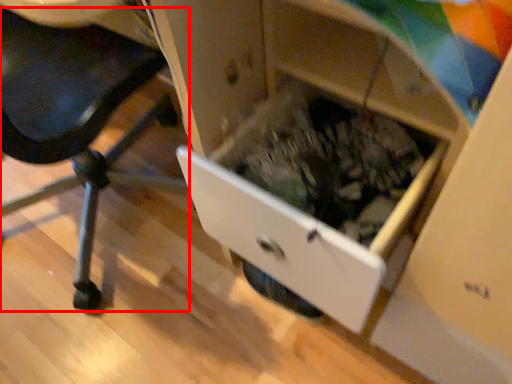
Question: Observing the image, what is the correct spatial positioning of furniture (annotated by the red box) in reference to drawer?

Choices:
 (A) right
 (B) left

Answer: (B)